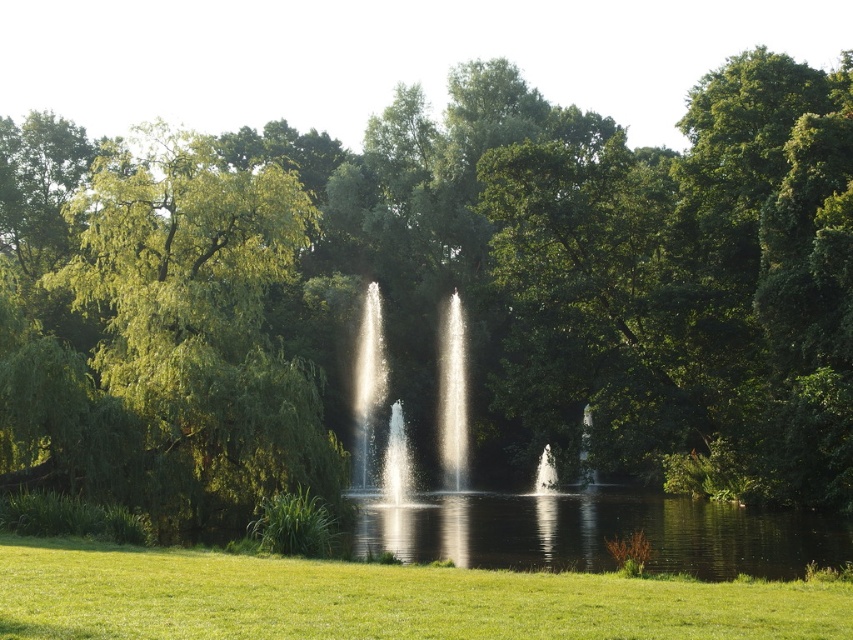
Question: Is green leafy tree at left bigger than green grass at lower center?

Choices:
 (A) no
 (B) yes

Answer: (B)

Question: Which of the following is the closest to the observer?

Choices:
 (A) green grass at lower center
 (B) green leafy tree at left

Answer: (A)

Question: Which point is farther to the camera?

Choices:
 (A) green leafy tree at left
 (B) green grass at lower center

Answer: (A)

Question: Is green leafy tree at left above green grass at lower center?

Choices:
 (A) yes
 (B) no

Answer: (A)

Question: From the image, what is the correct spatial relationship of green leafy tree at left in relation to green grass at lower center?

Choices:
 (A) left
 (B) right

Answer: (A)

Question: Which object appears closest to the camera in this image?

Choices:
 (A) green grass at lower center
 (B) green leafy tree at left

Answer: (A)